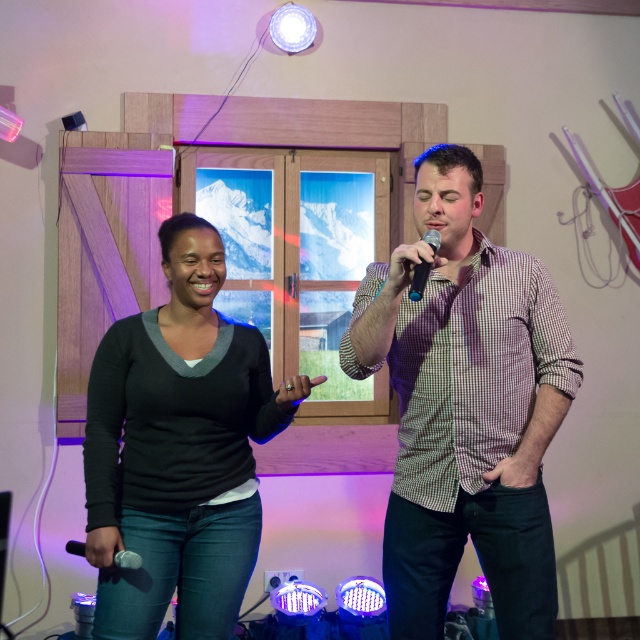
You are designing a stage layout where the black matte sweater at center and the silver metallic microphone at lower left need to be placed side by side. Based on their sizes, which object should be positioned first to ensure they fit properly?

The black matte sweater at center is wider than the silver metallic microphone at lower left, so it should be positioned first to accommodate its larger width.

You are a photographer standing at the back of the room. You want to take a closeup shot of the checkered fabric shirt at center. Considering the distance, can you use a standard camera lens with a minimum focusing distance of 1.5 meters?

The checkered fabric shirt at center is 1.85 meters away from the viewer. Since the minimum focusing distance of the camera lens is 1.5 meters, the photographer can focus on the checkered fabric shirt at center because 1.85 meters is beyond the minimum requirement.

You are a photographer trying to capture a closeup of both the matte black shirt at center and the checkered fabric shirt at center. Given that your camera has a depth of field that can focus on objects within 0.3 inches of each other, will you be able to get both shirts in focus at the same time?

The distance between the matte black shirt at center and the checkered fabric shirt at center is 0.38 inches. Since the depth of field can focus on objects within 0.3 inches, the shirts are slightly beyond the required range. Therefore, it might be challenging to get both in focus simultaneously.